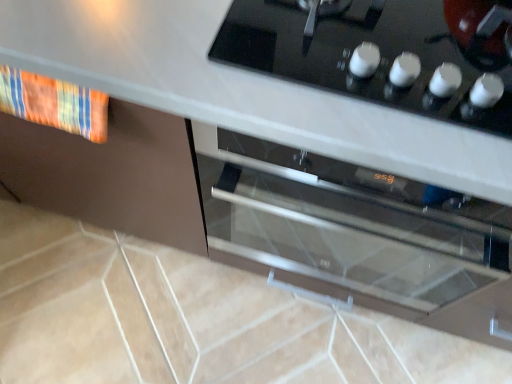
Identify the location of black glass cooktop at upper center. This screenshot has width=512, height=384. (384, 53).

Describe the element at coordinates (348, 222) in the screenshot. I see `satin silver oven at center` at that location.

At what (x,y) coordinates should I click in order to perform the action: click on textured fabric towel at left. Please return your answer as a coordinate pair (x, y). Looking at the image, I should click on (54, 103).

You are a GUI agent. You are given a task and a screenshot of the screen. Output one action in this format:
    pyautogui.click(x=<x>, y=<y>)
    Task: Click on the black glass cooktop at upper center
    This screenshot has height=384, width=512.
    Given the screenshot: What is the action you would take?
    384,53

From a real-world perspective, is textured fabric towel at left located beneath black glass cooktop at upper center?

Yes, from a real-world perspective, textured fabric towel at left is beneath black glass cooktop at upper center.

Locate an element on the screen. material lying behind the black glass cooktop at upper center is located at coordinates (54, 103).

In the image, is textured fabric towel at left positioned in front of or behind black glass cooktop at upper center?

Visually, textured fabric towel at left is located behind black glass cooktop at upper center.

From the image's perspective, is textured fabric towel at left on top of black glass cooktop at upper center?

Actually, textured fabric towel at left appears below black glass cooktop at upper center in the image.

Is satin silver oven at center bigger or smaller than textured fabric towel at left?

Clearly, satin silver oven at center is larger in size than textured fabric towel at left.

Who is shorter, satin silver oven at center or textured fabric towel at left?

textured fabric towel at left.

Visually, is satin silver oven at center positioned to the left or to the right of textured fabric towel at left?

Based on their positions, satin silver oven at center is located to the right of textured fabric towel at left.

From the image's perspective, which is below, satin silver oven at center or textured fabric towel at left?

satin silver oven at center, from the image's perspective.

Considering the relative sizes of black glass cooktop at upper center and satin silver oven at center in the image provided, is black glass cooktop at upper center wider than satin silver oven at center?

Incorrect, the width of black glass cooktop at upper center does not surpass that of satin silver oven at center.

Considering the sizes of objects black glass cooktop at upper center and satin silver oven at center in the image provided, who is shorter, black glass cooktop at upper center or satin silver oven at center?

With less height is black glass cooktop at upper center.

Would you say black glass cooktop at upper center is inside or outside satin silver oven at center?

black glass cooktop at upper center is not inside satin silver oven at center, it's outside.

Which object is more forward, black glass cooktop at upper center or satin silver oven at center?

black glass cooktop at upper center is in front.

Considering the relative sizes of textured fabric towel at left and satin silver oven at center in the image provided, is textured fabric towel at left wider than satin silver oven at center?

Incorrect, the width of textured fabric towel at left does not surpass that of satin silver oven at center.

Is textured fabric towel at left positioned with its back to satin silver oven at center?

textured fabric towel at left does not have its back to satin silver oven at center.

From the image's perspective, is textured fabric towel at left located beneath satin silver oven at center?

Incorrect, from the image's perspective, textured fabric towel at left is higher than satin silver oven at center.

Consider the image. Is textured fabric towel at left taller than satin silver oven at center?

No, textured fabric towel at left is not taller than satin silver oven at center.

Which object is further away from the camera, black glass cooktop at upper center or textured fabric towel at left?

textured fabric towel at left is further away from the camera.

Considering the sizes of objects black glass cooktop at upper center and textured fabric towel at left in the image provided, who is wider, black glass cooktop at upper center or textured fabric towel at left?

black glass cooktop at upper center.

From the image's perspective, does black glass cooktop at upper center appear higher than textured fabric towel at left?

Yes, from the image's perspective, black glass cooktop at upper center is above textured fabric towel at left.

Is point (393, 260) positioned in front of point (407, 15)?

No, it is not.

Between satin silver oven at center and black glass cooktop at upper center, which one has larger size?

satin silver oven at center is bigger.

In terms of height, does satin silver oven at center look taller or shorter compared to black glass cooktop at upper center?

Clearly, satin silver oven at center is taller compared to black glass cooktop at upper center.

Considering the relative sizes of satin silver oven at center and black glass cooktop at upper center in the image provided, is satin silver oven at center wider than black glass cooktop at upper center?

Correct, the width of satin silver oven at center exceeds that of black glass cooktop at upper center.

Where is `material below the black glass cooktop at upper center (from a real-world perspective)`? This screenshot has height=384, width=512. material below the black glass cooktop at upper center (from a real-world perspective) is located at coordinates (54, 103).

At what (x,y) coordinates should I click in order to perform the action: click on oven below the textured fabric towel at left (from the image's perspective). Please return your answer as a coordinate pair (x, y). This screenshot has height=384, width=512. Looking at the image, I should click on (348, 222).

Considering their positions, is satin silver oven at center positioned further to textured fabric towel at left than black glass cooktop at upper center?

satin silver oven at center is further to textured fabric towel at left.

Which object lies nearer to the anchor point textured fabric towel at left, black glass cooktop at upper center or satin silver oven at center?

The object closer to textured fabric towel at left is black glass cooktop at upper center.

Considering their positions, is black glass cooktop at upper center positioned closer to satin silver oven at center than textured fabric towel at left?

Based on the image, black glass cooktop at upper center appears to be nearer to satin silver oven at center.

When comparing their distances from black glass cooktop at upper center, does textured fabric towel at left or satin silver oven at center seem closer?

Based on the image, satin silver oven at center appears to be nearer to black glass cooktop at upper center.

Which object lies further to the anchor point black glass cooktop at upper center, satin silver oven at center or textured fabric towel at left?

textured fabric towel at left lies further to black glass cooktop at upper center than the other object.

When comparing their distances from satin silver oven at center, does textured fabric towel at left or black glass cooktop at upper center seem further?

The object further to satin silver oven at center is textured fabric towel at left.

You are a GUI agent. You are given a task and a screenshot of the screen. Output one action in this format:
    pyautogui.click(x=<x>, y=<y>)
    Task: Click on the home appliance between textured fabric towel at left and satin silver oven at center in the horizontal direction
    This screenshot has width=512, height=384.
    Given the screenshot: What is the action you would take?
    pyautogui.click(x=384, y=53)